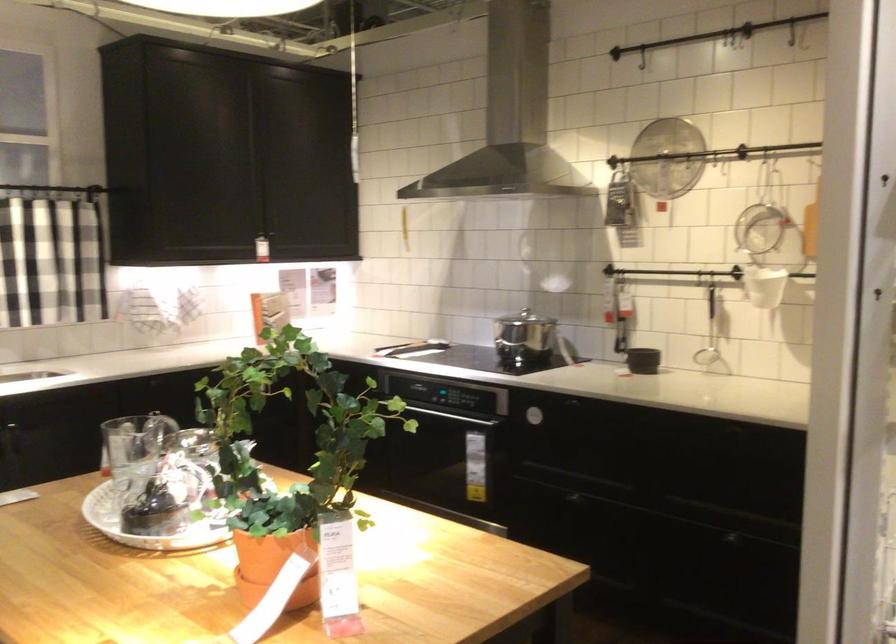
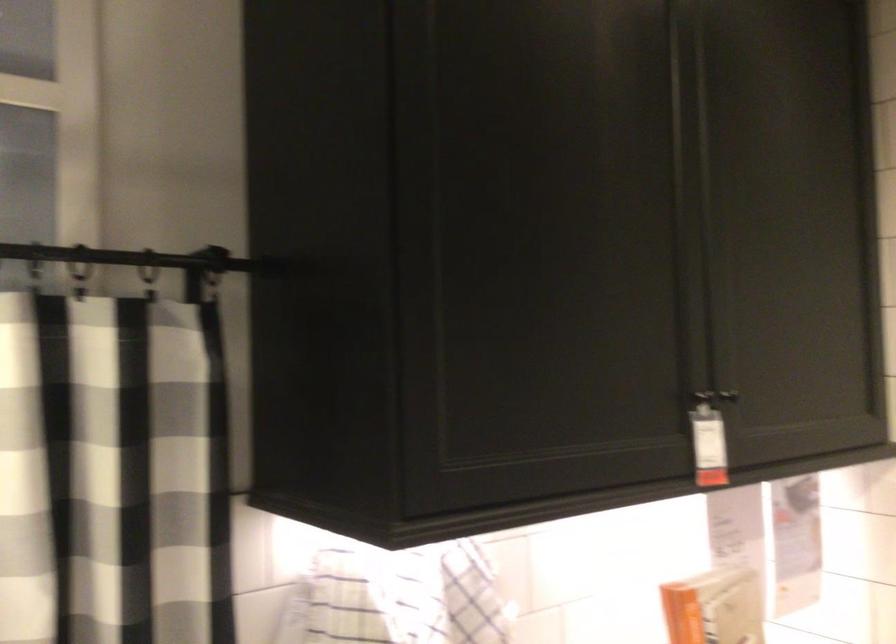
Based on the photo, in a continuous first-person perspective shot, in which direction is the camera moving?

The cameraman walked toward left, forward.